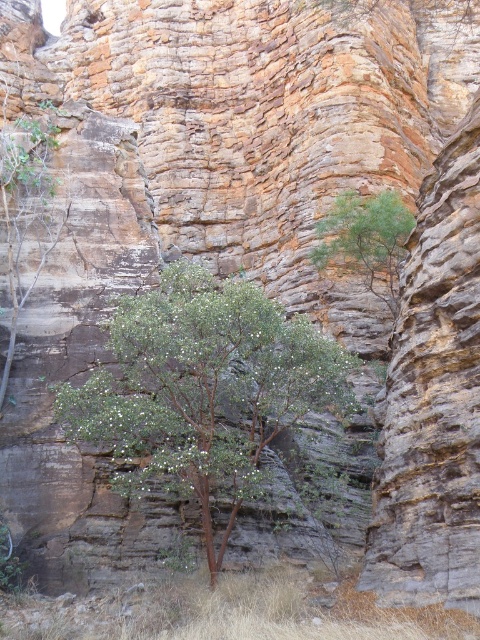
Question: Which of the following is the closest to the observer?

Choices:
 (A) click(359, 193)
 (B) click(12, 230)
 (C) click(186, 419)

Answer: (C)

Question: Which point is farther to the camera?

Choices:
 (A) (392, 250)
 (B) (103, 397)
 (C) (25, 221)

Answer: (A)

Question: Can you confirm if green leafy tree at center is positioned below green leafy tree at upper center?

Choices:
 (A) yes
 (B) no

Answer: (A)

Question: Estimate the real-world distances between objects in this image. Which object is closer to the green leafy tree at upper center?

Choices:
 (A) green leafy shrub at left
 (B) green leafy tree at center

Answer: (B)

Question: Can you confirm if green leafy tree at center is positioned to the right of green leafy tree at upper center?

Choices:
 (A) yes
 (B) no

Answer: (B)

Question: Can you confirm if green leafy shrub at left is positioned above green leafy tree at upper center?

Choices:
 (A) no
 (B) yes

Answer: (B)